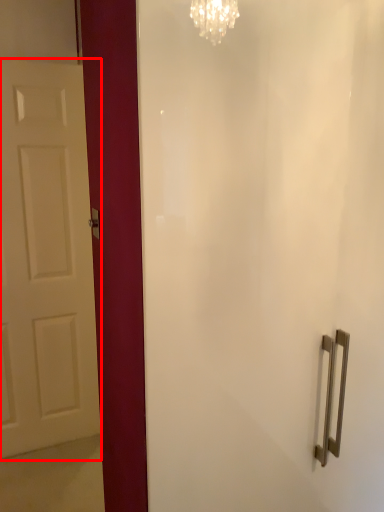
Question: From the image's perspective, where is door (annotated by the red box) located relative to door handle?

Choices:
 (A) above
 (B) below

Answer: (A)